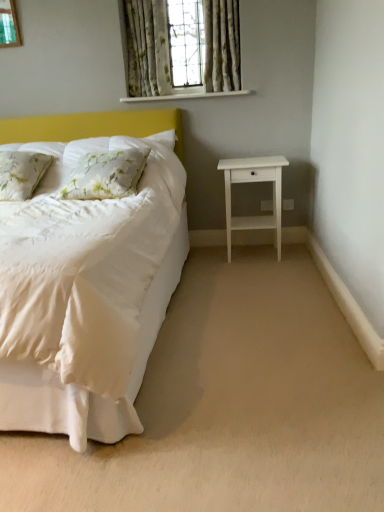
Question: Considering the relative positions of floral fabric curtain at upper center, marked as the 1th curtain in a left-to-right arrangement, and floral fabric pillow at left, arranged as the first pillow when viewed from the right, in the image provided, is floral fabric curtain at upper center, marked as the 1th curtain in a left-to-right arrangement, to the left of floral fabric pillow at left, arranged as the first pillow when viewed from the right, from the viewer's perspective?

Choices:
 (A) yes
 (B) no

Answer: (B)

Question: Is floral fabric curtain at upper center, placed as the 2th curtain when sorted from right to left, further to camera compared to floral fabric pillow at left, arranged as the first pillow when viewed from the right?

Choices:
 (A) yes
 (B) no

Answer: (A)

Question: From a real-world perspective, is floral fabric curtain at upper center, marked as the 1th curtain in a left-to-right arrangement, located higher than floral fabric pillow at left, marked as the second pillow in a left-to-right arrangement?

Choices:
 (A) yes
 (B) no

Answer: (A)

Question: Does floral fabric curtain at upper center, placed as the 2th curtain when sorted from right to left, have a lesser height compared to floral fabric pillow at left, marked as the second pillow in a left-to-right arrangement?

Choices:
 (A) yes
 (B) no

Answer: (B)

Question: Is floral fabric curtain at upper center, marked as the 1th curtain in a left-to-right arrangement, to the right of floral fabric pillow at left, marked as the second pillow in a left-to-right arrangement, from the viewer's perspective?

Choices:
 (A) yes
 (B) no

Answer: (A)

Question: Is floral fabric pillow at left, marked as the 2th pillow in a right-to-left arrangement, taller or shorter than white matte nightstand at right?

Choices:
 (A) tall
 (B) short

Answer: (B)

Question: Does point (36, 166) appear closer or farther from the camera than point (263, 159)?

Choices:
 (A) closer
 (B) farther

Answer: (A)

Question: Considering the positions of floral fabric pillow at left, the first pillow positioned from the left, and white matte nightstand at right in the image, is floral fabric pillow at left, the first pillow positioned from the left, bigger or smaller than white matte nightstand at right?

Choices:
 (A) big
 (B) small

Answer: (B)

Question: Considering their positions, is floral fabric pillow at left, the first pillow positioned from the left, located in front of or behind white matte nightstand at right?

Choices:
 (A) front
 (B) behind

Answer: (A)

Question: Is beige carpet at lower center situated inside floral fabric curtain at upper center, which is the first curtain in right-to-left order, or outside?

Choices:
 (A) inside
 (B) outside

Answer: (B)

Question: In terms of width, does beige carpet at lower center look wider or thinner when compared to floral fabric curtain at upper center, which is the first curtain in right-to-left order?

Choices:
 (A) thin
 (B) wide

Answer: (B)

Question: Based on their positions, is beige carpet at lower center located to the left or right of floral fabric curtain at upper center, which is the first curtain in right-to-left order?

Choices:
 (A) left
 (B) right

Answer: (A)

Question: In terms of size, does beige carpet at lower center appear bigger or smaller than floral fabric curtain at upper center, the 2th curtain viewed from the left?

Choices:
 (A) small
 (B) big

Answer: (B)

Question: From a real-world perspective, is white matte nightstand at right physically located above or below floral fabric pillow at left, marked as the second pillow in a left-to-right arrangement?

Choices:
 (A) below
 (B) above

Answer: (A)

Question: Which is correct: white matte nightstand at right is inside floral fabric pillow at left, arranged as the first pillow when viewed from the right, or outside of it?

Choices:
 (A) outside
 (B) inside

Answer: (A)